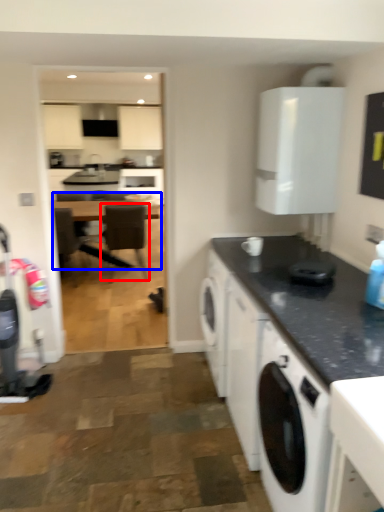
Question: Among these objects, which one is farthest to the camera, chair (highlighted by a red box) or table (highlighted by a blue box)?

Choices:
 (A) chair
 (B) table

Answer: (B)